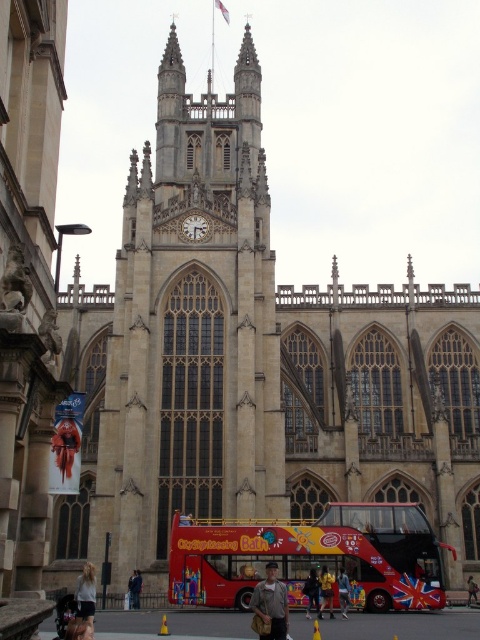
You are a photographer standing in front of the cathedral. You want to take a picture that includes both the light brown hair at lower left and the dark gray fabric jacket at center. Based on their positions, which object should appear on the left side of the photo?

The light brown hair at lower left should appear on the left side of the photo because it is positioned to the left of the dark gray fabric jacket at center.